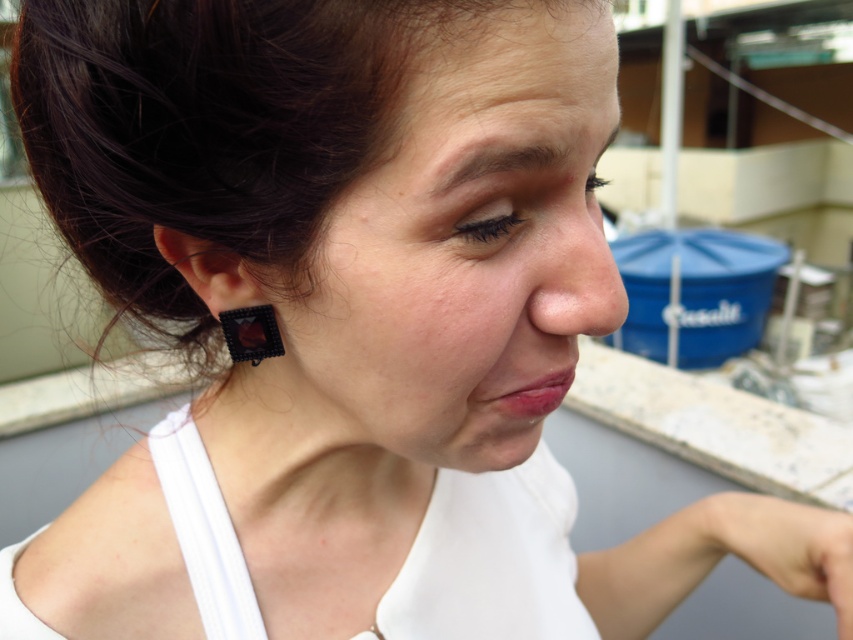
You are standing in front of the person in the image. There are two points marked on the image. The first point is at coordinates point (532,168) and the second point is at point (238,353). Which point is closer to you?

Point (532,168) is closer to the viewer than point (238,353).

You are a photographer adjusting the focus on your camera. You need to capture both the black beaded earring at ear and the smooth skin nose at center clearly. Which object should you adjust the focus on first to ensure both are sharp?

The black beaded earring at ear has a lesser width compared to the smooth skin nose at center, so you should focus on the smaller black beaded earring at ear first to ensure both are in focus.